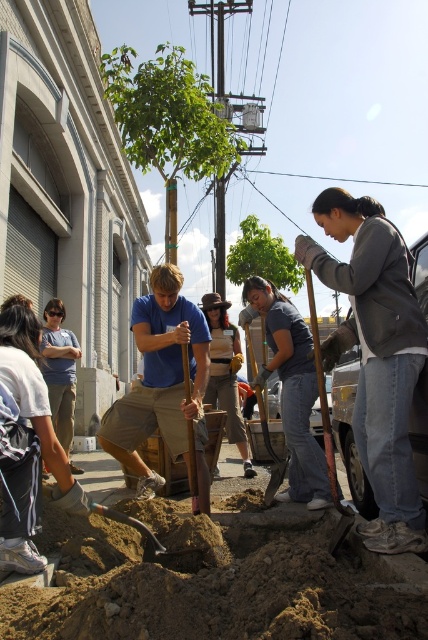
Describe the element at coordinates (169, 120) in the screenshot. I see `green leafy tree at upper center` at that location.

Between green leafy tree at upper center and brown leather hat at center, which one is positioned higher?

green leafy tree at upper center

Is point (124, 124) positioned after point (210, 305)?

Yes.

This screenshot has height=640, width=428. Find the location of `green leafy tree at upper center`. green leafy tree at upper center is located at coordinates (169, 120).

Can you confirm if denim jeans at center is positioned below brown leather hat at center?

Correct, denim jeans at center is located below brown leather hat at center.

Is denim jeans at center in front of brown leather hat at center?

Yes, denim jeans at center is in front of brown leather hat at center.

Does point (327, 486) come behind point (208, 401)?

No, it is not.

Identify the location of denim jeans at center. The height and width of the screenshot is (640, 428). (291, 390).

Consider the image. Between denim jacket at lower left and denim jeans at center, which one is positioned lower?

denim jacket at lower left is below.

From the picture: Is denim jacket at lower left closer to camera compared to denim jeans at center?

Yes, denim jacket at lower left is closer to the viewer.

Find the location of a particular element. denim jacket at lower left is located at coordinates (26, 444).